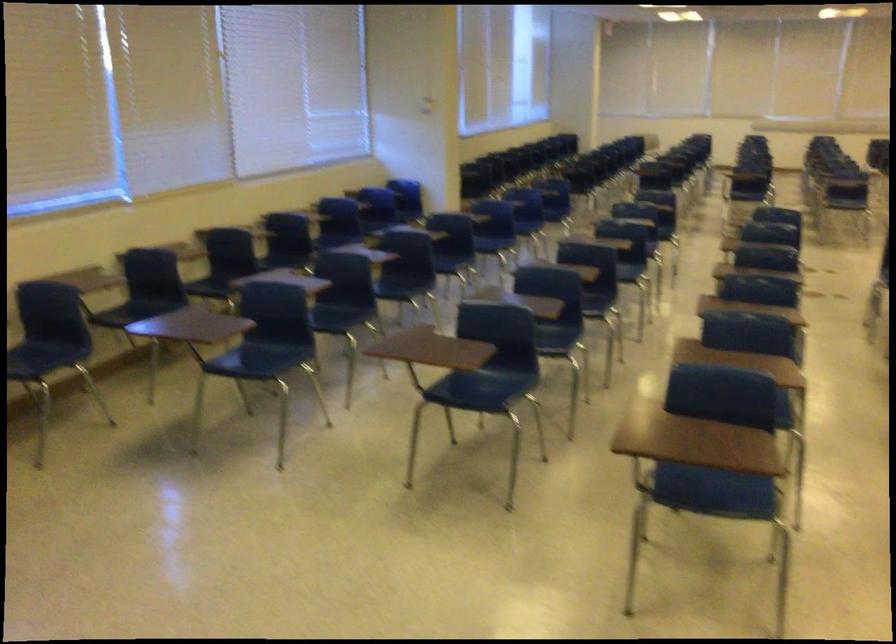
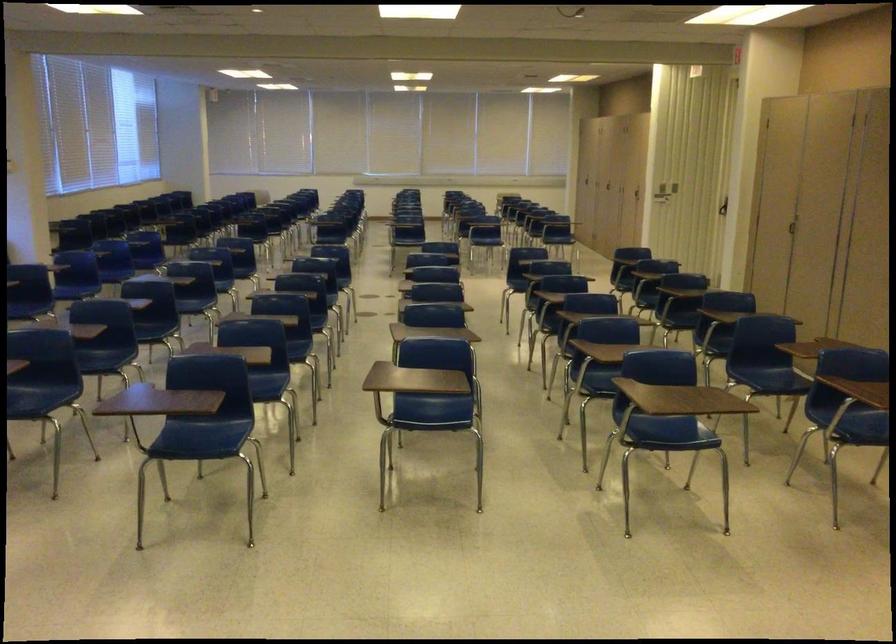
Find the pixel in the second image that matches (x=710, y=476) in the first image.

(203, 436)